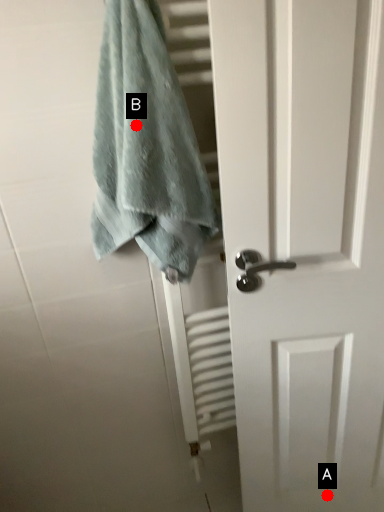
Question: Two points are circled on the image, labeled by A and B beside each circle. Which point appears closest to the camera in this image?

Choices:
 (A) A is closer
 (B) B is closer

Answer: (B)